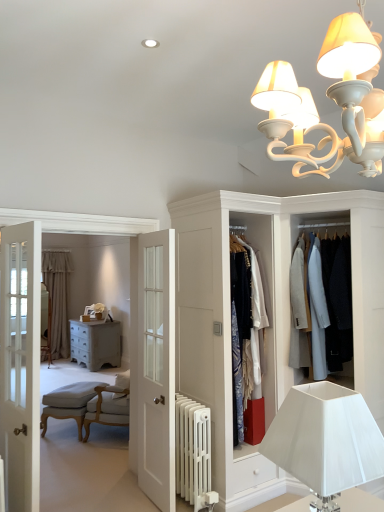
Question: From a real-world perspective, is light beige fabric armchair at lower left physically below light gray wool coat at center, marked as the second clothing in a left-to-right arrangement?

Choices:
 (A) no
 (B) yes

Answer: (B)

Question: From a real-world perspective, is light beige fabric armchair at lower left over light gray wool coat at center, marked as the second clothing in a left-to-right arrangement?

Choices:
 (A) yes
 (B) no

Answer: (B)

Question: Is light beige fabric armchair at lower left thinner than light gray wool coat at center, marked as the second clothing in a left-to-right arrangement?

Choices:
 (A) no
 (B) yes

Answer: (B)

Question: Is the surface of light beige fabric armchair at lower left in direct contact with light gray wool coat at center, marked as the second clothing in a left-to-right arrangement?

Choices:
 (A) no
 (B) yes

Answer: (A)

Question: Is light beige fabric armchair at lower left bigger than light gray wool coat at center, marked as the second clothing in a left-to-right arrangement?

Choices:
 (A) no
 (B) yes

Answer: (A)

Question: Can you confirm if light beige fabric armchair at lower left is smaller than light gray wool coat at center, which is the first clothing from right to left?

Choices:
 (A) no
 (B) yes

Answer: (B)

Question: Does light gray wool coat at center, marked as the second clothing in a left-to-right arrangement, have a larger size compared to white glossy door at center?

Choices:
 (A) no
 (B) yes

Answer: (B)

Question: Is light gray wool coat at center, which is the first clothing from right to left, thinner than white glossy door at center?

Choices:
 (A) yes
 (B) no

Answer: (B)

Question: From a real-world perspective, is light gray wool coat at center, marked as the second clothing in a left-to-right arrangement, over white glossy door at center?

Choices:
 (A) no
 (B) yes

Answer: (B)

Question: Are light gray wool coat at center, which is the first clothing from right to left, and white glossy door at center beside each other?

Choices:
 (A) yes
 (B) no

Answer: (B)

Question: Is the depth of light gray wool coat at center, which is the first clothing from right to left, greater than that of white glossy door at center?

Choices:
 (A) yes
 (B) no

Answer: (A)

Question: Is light gray wool coat at center, which is the first clothing from right to left, aimed at white glossy door at center?

Choices:
 (A) no
 (B) yes

Answer: (A)

Question: From a real-world perspective, is white matte chandelier at upper center, which appears as the 2th lamp when ordered from the bottom, under white painted radiator at lower center?

Choices:
 (A) yes
 (B) no

Answer: (B)